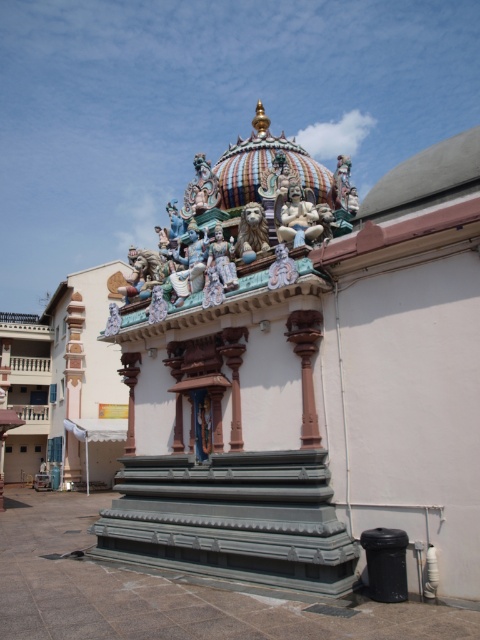
Is polished white statue at center further to the viewer compared to matte gold lion at center?

No, polished white statue at center is closer to the viewer.

Is point (312, 200) positioned behind point (244, 227)?

No, (312, 200) is closer to viewer.

Who is more forward, (313,205) or (249,212)?

Result: Point (313,205) is more forward.

You are a GUI agent. You are given a task and a screenshot of the screen. Output one action in this format:
    pyautogui.click(x=<x>, y=<y>)
    Task: Click on the polished white statue at center
    The image size is (480, 640).
    Given the screenshot: What is the action you would take?
    pyautogui.click(x=296, y=216)